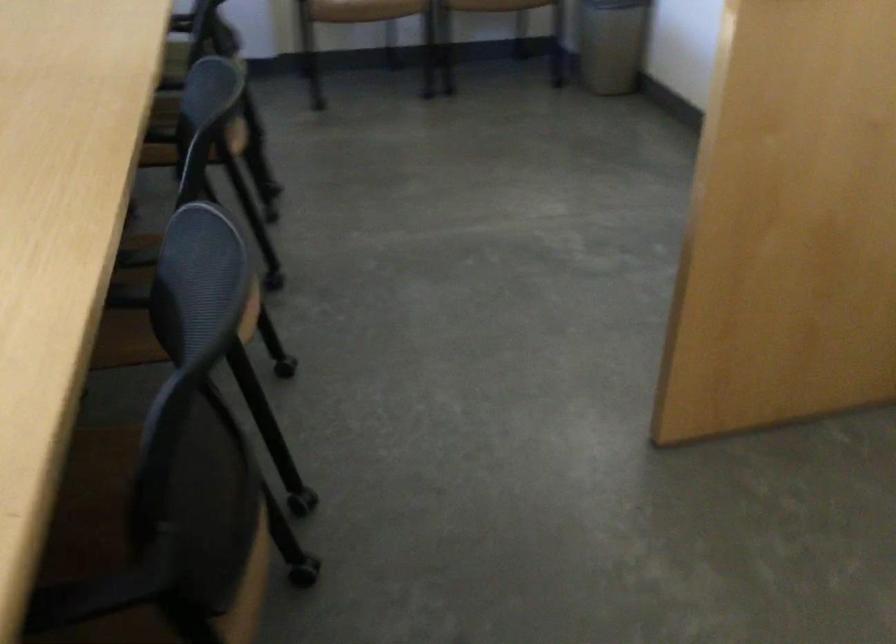
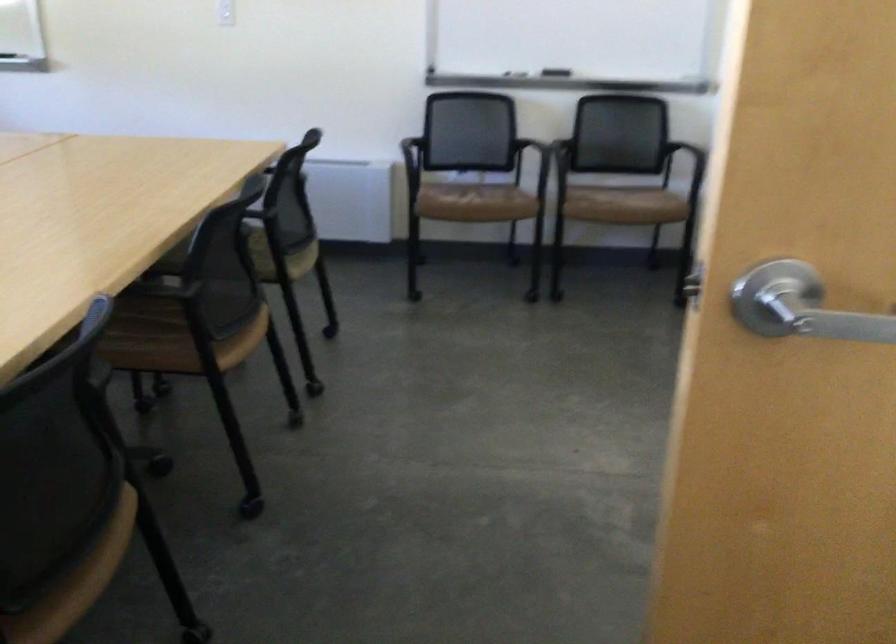
Question: In a continuous first-person perspective shot, in which direction is the camera moving?

Choices:
 (A) Left
 (B) Right
 (C) Forward
 (D) Backward

Answer: (D)